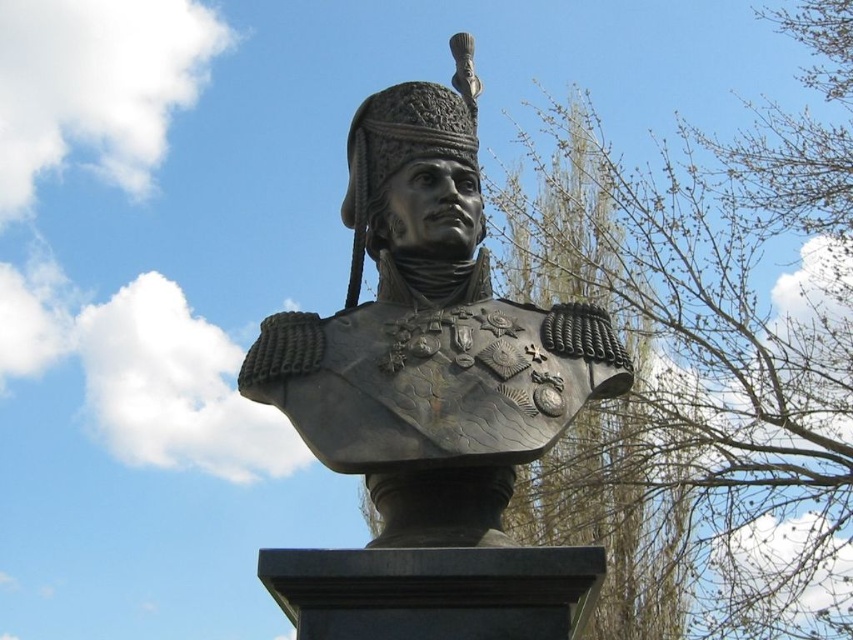
In the scene shown: Who is positioned more to the right, bare branches at upper center or shiny bronze helmet at center?

Positioned to the right is bare branches at upper center.

Is point (769, 582) closer to camera compared to point (381, 147)?

That is False.

Does point (675, 400) lie in front of point (360, 129)?

No, (675, 400) is further to viewer.

Locate an element on the screen. bare branches at upper center is located at coordinates (715, 352).

Is shiny bronze bust at center shorter than shiny bronze helmet at center?

In fact, shiny bronze bust at center may be taller than shiny bronze helmet at center.

Which is below, shiny bronze bust at center or shiny bronze helmet at center?

Positioned lower is shiny bronze bust at center.

At what (x,y) coordinates should I click in order to perform the action: click on shiny bronze bust at center. Please return your answer as a coordinate pair (x, y). Looking at the image, I should click on (428, 333).

Does bare branches at upper center have a lesser width compared to shiny bronze bust at center?

In fact, bare branches at upper center might be wider than shiny bronze bust at center.

In the scene shown: Measure the distance between bare branches at upper center and shiny bronze bust at center.

bare branches at upper center is 55.15 meters from shiny bronze bust at center.

Is point (706, 531) positioned behind point (399, 372)?

Yes, point (706, 531) is behind point (399, 372).

Identify the location of bare branches at upper center. (715, 352).